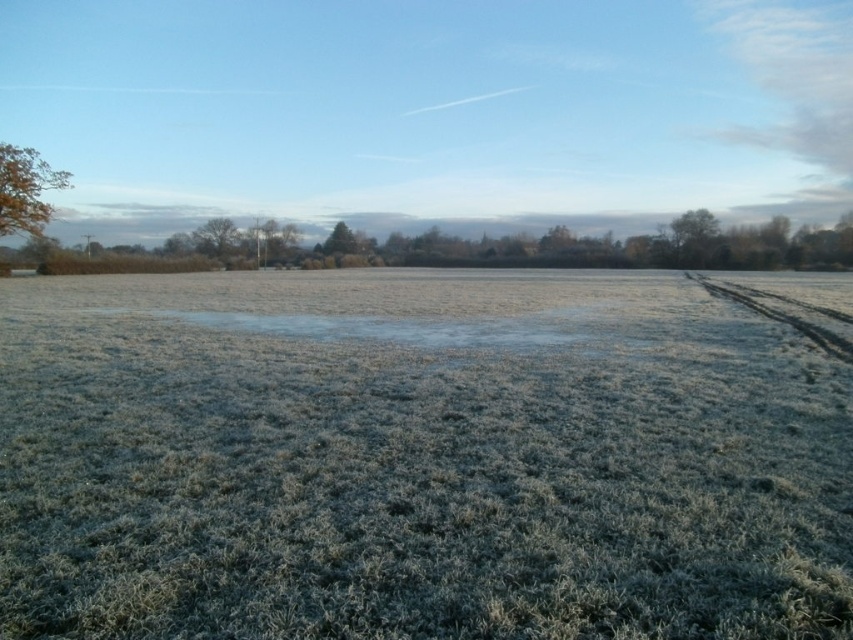
Does frosted grass at center appear on the left side of brown textured tree at center?

No, frosted grass at center is not to the left of brown textured tree at center.

Can you confirm if frosted grass at center is positioned to the right of brown textured tree at center?

Indeed, frosted grass at center is positioned on the right side of brown textured tree at center.

The height and width of the screenshot is (640, 853). I want to click on frosted grass at center, so click(x=416, y=460).

Is frosted grass at center closer to camera compared to green textured tree at center?

That is True.

Between point (685, 320) and point (339, 252), which one is positioned behind?

Point (339, 252)

Based on the photo, who is more forward, (520, 289) or (337, 228)?

Point (520, 289) is more forward.

Locate an element on the screen. The image size is (853, 640). frosted grass at center is located at coordinates (416, 460).

Does point (28, 161) come closer to viewer compared to point (689, 257)?

Yes, it is.

Can you confirm if golden brown leaves at upper left is bigger than green matte tree at upper right?

Incorrect, golden brown leaves at upper left is not larger than green matte tree at upper right.

Is point (51, 176) positioned before point (701, 257)?

Yes, point (51, 176) is closer to viewer.

Find the location of `golden brown leaves at upper left`. golden brown leaves at upper left is located at coordinates (25, 189).